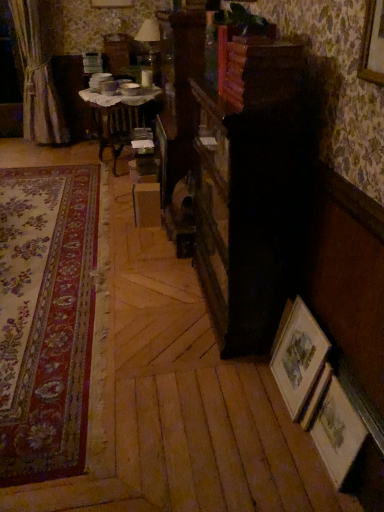
Question: Is wooden framed print at lower right, which appears as the 2th picture frame when viewed from the right, aimed at floral carpet at left?

Choices:
 (A) yes
 (B) no

Answer: (B)

Question: Considering the relative sizes of wooden framed print at lower right, which appears as the 2th picture frame when viewed from the right, and floral carpet at left in the image provided, is wooden framed print at lower right, which appears as the 2th picture frame when viewed from the right, wider than floral carpet at left?

Choices:
 (A) yes
 (B) no

Answer: (B)

Question: Is wooden framed print at lower right, which appears as the 2th picture frame when viewed from the right, to the left of floral carpet at left from the viewer's perspective?

Choices:
 (A) no
 (B) yes

Answer: (A)

Question: Is wooden framed print at lower right, which appears as the 1th picture frame when viewed from the left, positioned beyond the bounds of floral carpet at left?

Choices:
 (A) yes
 (B) no

Answer: (A)

Question: Is wooden framed print at lower right, which appears as the 1th picture frame when viewed from the left, positioned before floral carpet at left?

Choices:
 (A) no
 (B) yes

Answer: (A)

Question: Visually, is wooden framed print at lower right, which appears as the 2th picture frame when viewed from the right, positioned to the left or to the right of floral carpet at left?

Choices:
 (A) left
 (B) right

Answer: (B)

Question: In terms of size, does wooden framed print at lower right, which appears as the 2th picture frame when viewed from the right, appear bigger or smaller than floral carpet at left?

Choices:
 (A) small
 (B) big

Answer: (A)

Question: From a real-world perspective, relative to floral carpet at left, is wooden framed print at lower right, which appears as the 1th picture frame when viewed from the left, vertically above or below?

Choices:
 (A) below
 (B) above

Answer: (B)

Question: Considering the positions of point (289, 335) and point (56, 202), is point (289, 335) closer or farther from the camera than point (56, 202)?

Choices:
 (A) closer
 (B) farther

Answer: (A)

Question: Considering their positions, is silky beige curtain at left located in front of or behind wooden at upper center?

Choices:
 (A) front
 (B) behind

Answer: (B)

Question: Considering the positions of silky beige curtain at left and wooden at upper center in the image, is silky beige curtain at left wider or thinner than wooden at upper center?

Choices:
 (A) thin
 (B) wide

Answer: (B)

Question: Would you say silky beige curtain at left is to the left or to the right of wooden at upper center in the picture?

Choices:
 (A) left
 (B) right

Answer: (A)

Question: Is point (24, 118) closer or farther from the camera than point (236, 55)?

Choices:
 (A) closer
 (B) farther

Answer: (B)

Question: Considering the positions of point (142, 137) and point (332, 433), is point (142, 137) closer or farther from the camera than point (332, 433)?

Choices:
 (A) closer
 (B) farther

Answer: (B)

Question: In terms of height, does wooden table at center look taller or shorter compared to wooden picture frame at lower right, marked as the 1th picture frame in a right-to-left arrangement?

Choices:
 (A) tall
 (B) short

Answer: (A)